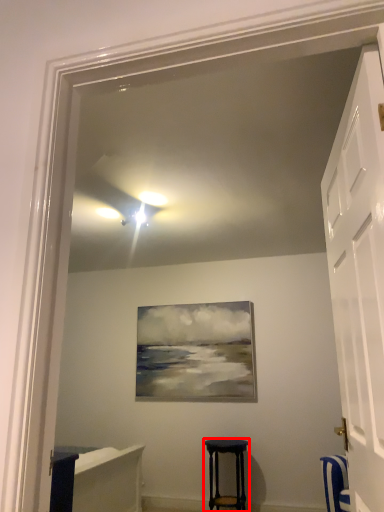
Question: From the image's perspective, what is the correct spatial positioning of stool (annotated by the red box) in reference to door?

Choices:
 (A) below
 (B) above

Answer: (A)